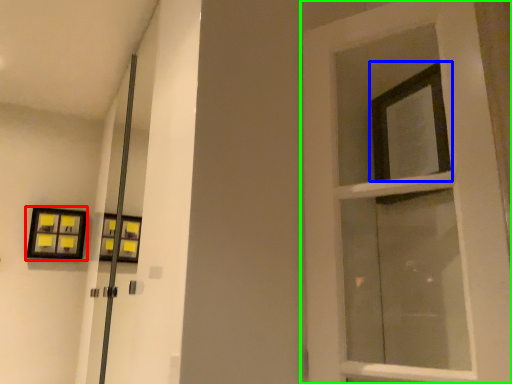
Question: Estimate the real-world distances between objects in this image. Which object is farther from picture frame (highlighted by a red box), window (highlighted by a blue box) or door (highlighted by a green box)?

Choices:
 (A) window
 (B) door

Answer: (A)